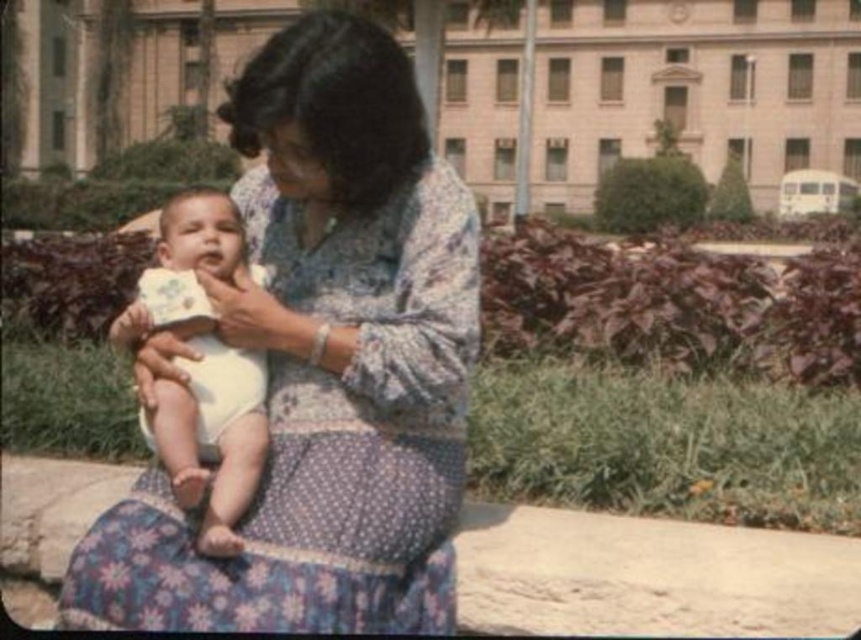
Question: Can you confirm if floral fabric dress at center is positioned above white clothed baby at center?

Choices:
 (A) yes
 (B) no

Answer: (B)

Question: Which point is closer to the camera taking this photo?

Choices:
 (A) (249, 301)
 (B) (132, 336)

Answer: (A)

Question: Which point is closer to the camera taking this photo?

Choices:
 (A) (227, 88)
 (B) (177, 268)

Answer: (B)

Question: Does floral fabric dress at center appear under white clothed baby at center?

Choices:
 (A) yes
 (B) no

Answer: (A)

Question: Is floral fabric dress at center behind white clothed baby at center?

Choices:
 (A) no
 (B) yes

Answer: (A)